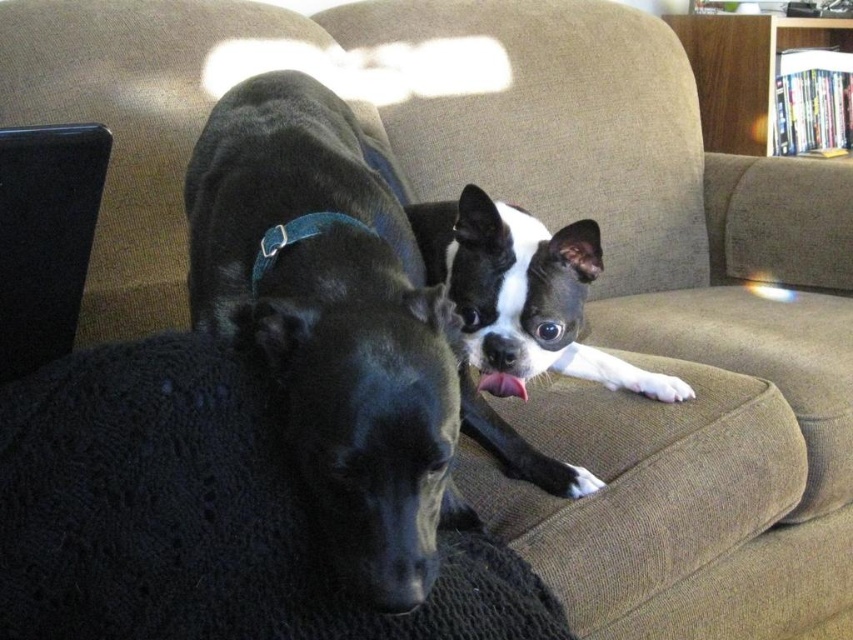
In the scene shown: Is the position of wooden bookshelf at upper right more distant than that of blue fabric neckband at center?

That is True.

Who is higher up, wooden bookshelf at upper right or blue fabric neckband at center?

wooden bookshelf at upper right

What do you see at coordinates (746, 70) in the screenshot?
I see `wooden bookshelf at upper right` at bounding box center [746, 70].

This screenshot has height=640, width=853. I want to click on wooden bookshelf at upper right, so click(x=746, y=70).

Is black matte dog at center in front of blue fabric neckband at center?

Yes, it is in front of blue fabric neckband at center.

Which is more to the right, black matte dog at center or blue fabric neckband at center?

black matte dog at center

Does point (276, 296) come closer to viewer compared to point (283, 221)?

That is True.

The width and height of the screenshot is (853, 640). What are the coordinates of `black matte dog at center` in the screenshot? It's located at (338, 326).

Is black matte dog at center above wooden bookshelf at upper right?

Actually, black matte dog at center is below wooden bookshelf at upper right.

Between black matte dog at center and wooden bookshelf at upper right, which one appears on the left side from the viewer's perspective?

Positioned to the left is black matte dog at center.

This screenshot has height=640, width=853. I want to click on black matte dog at center, so click(338, 326).

Where is `black matte dog at center`? This screenshot has height=640, width=853. black matte dog at center is located at coordinates (338, 326).